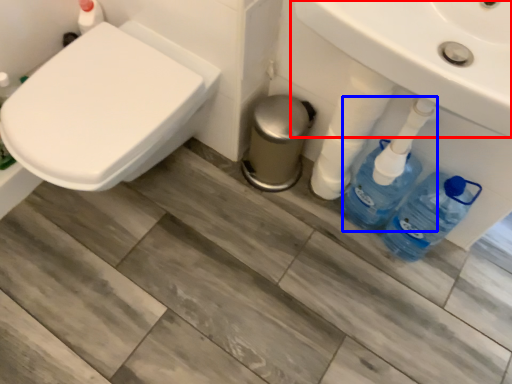
Question: Which of the following is the farthest to the observer, sink (highlighted by a red box) or cleaning product (highlighted by a blue box)?

Choices:
 (A) sink
 (B) cleaning product

Answer: (B)